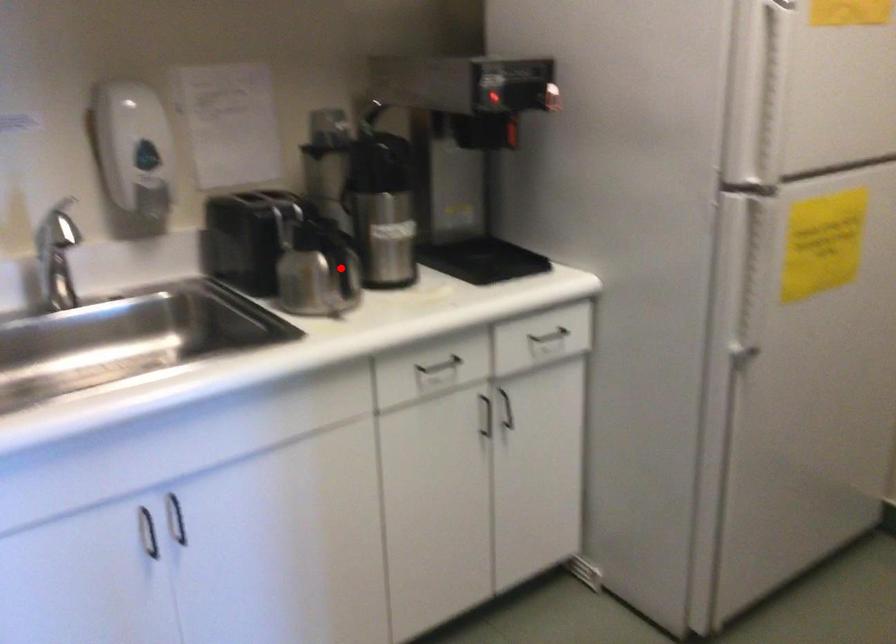
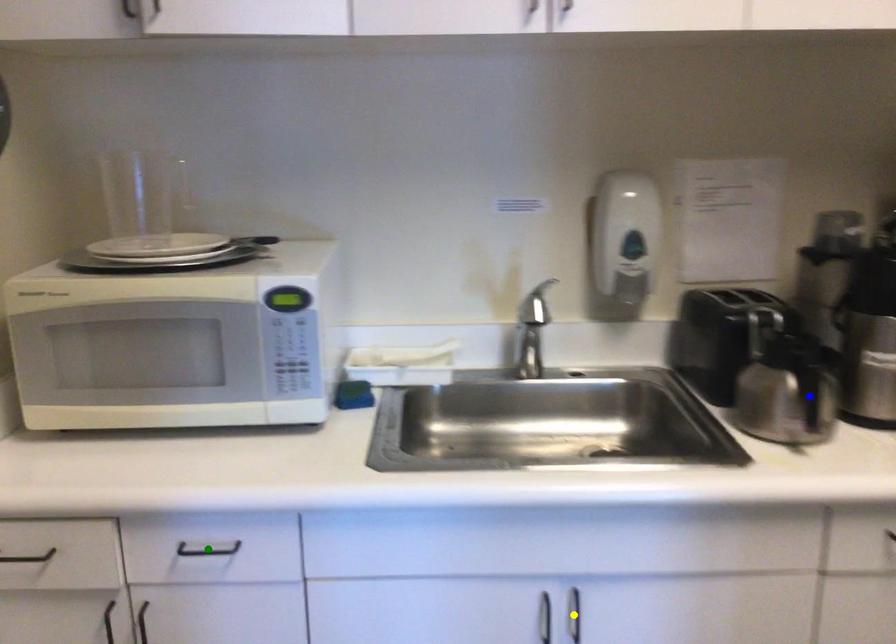
Question: I am providing you with two images of the same scene from different viewpoints. A red point is marked on the first image. You are given multiple points on the second image. Which point in image 2 represents the same 3d spot as the red point in image 1?

Choices:
 (A) yellow point
 (B) blue point
 (C) green point

Answer: (B)